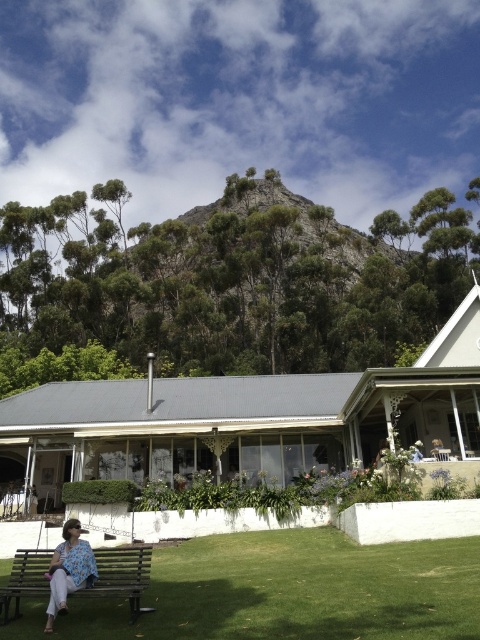
Question: Can you confirm if green grass at lower left is positioned to the left of floral fabric dress at lower left?

Choices:
 (A) yes
 (B) no

Answer: (B)

Question: Is green grass at lower left to the left of wooden bench at lower left from the viewer's perspective?

Choices:
 (A) yes
 (B) no

Answer: (B)

Question: Which of the following is the farthest from the observer?

Choices:
 (A) wooden bench at lower left
 (B) floral fabric dress at lower left

Answer: (A)

Question: Which of these objects is positioned farthest from the floral fabric dress at lower left?

Choices:
 (A) green grass at lower left
 (B) wooden bench at lower left

Answer: (A)

Question: Considering the real-world distances, which object is farthest from the floral fabric dress at lower left?

Choices:
 (A) wooden bench at lower left
 (B) green grass at lower left

Answer: (B)

Question: Can you confirm if green grass at lower left is smaller than floral fabric dress at lower left?

Choices:
 (A) yes
 (B) no

Answer: (B)